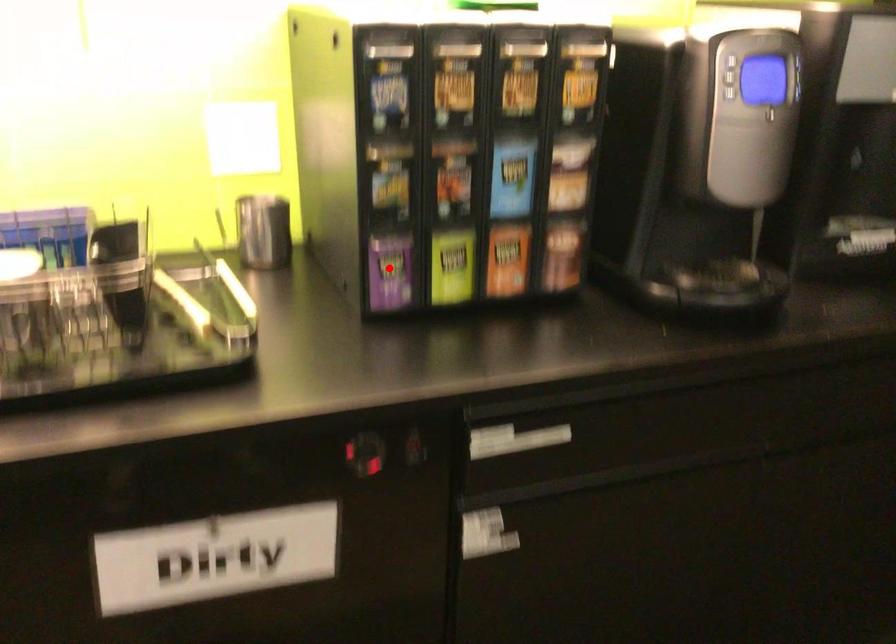
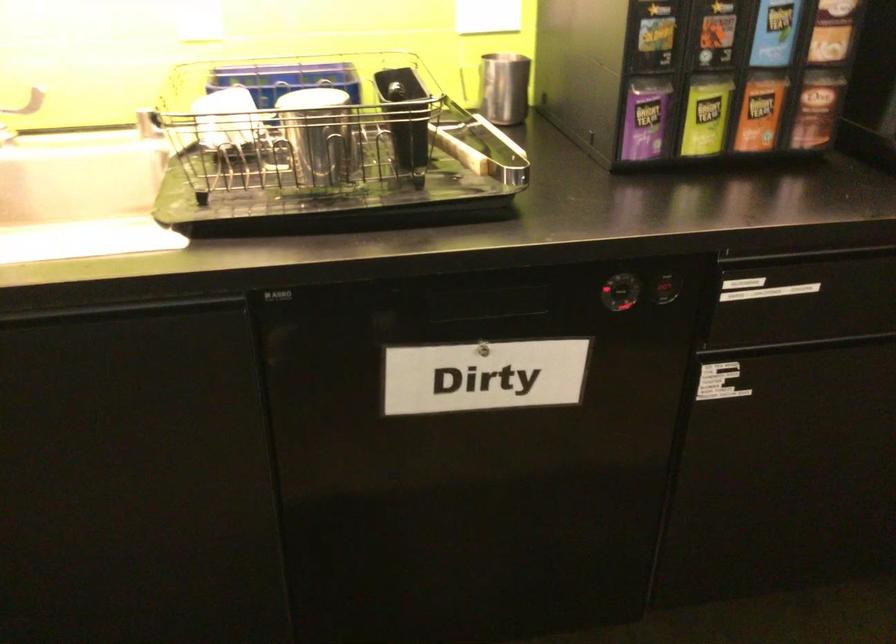
Where in the second image is the point corresponding to the highlighted location from the first image?

(645, 118)